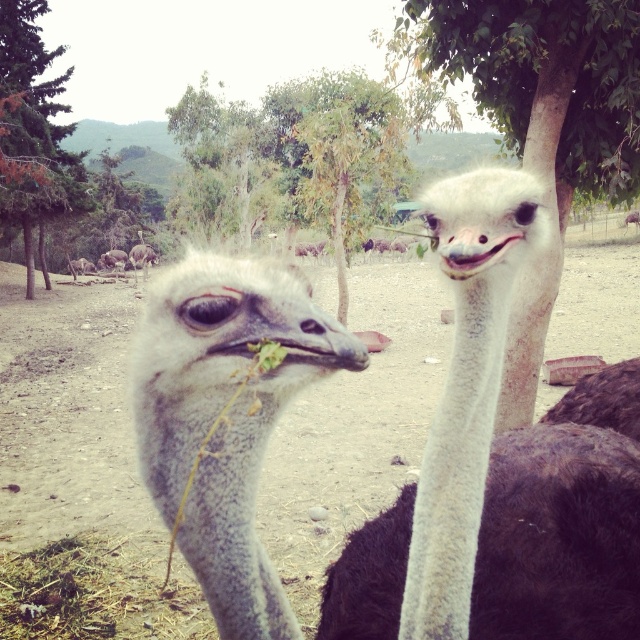
You are a wildlife photographer aiming to capture a photo of both the white feathered ostrich at center and the white fuzzy neck at center. Since you want them both in focus, you need to know which one is closer to you. Based on the scene, which one is closer?

The white fuzzy neck at center is closer to you because it is positioned to the left of the white feathered ostrich at center, which is to its right.

You are a wildlife photographer trying to capture a clear shot of both the white feathered ostrich at center and the white fuzzy neck at center. Since your camera has a limited field of view, you need to know which object is wider to frame the shot properly. Which one has a greater width?

The white feathered ostrich at center is wider than the white fuzzy neck at center according to the description, so you should frame the shot to accommodate the width of the white feathered ostrich at center.

You are a wildlife photographer trying to capture a photo of the white feathered ostrich at center and the white fuzzy neck at center. You want to ensure both subjects are in focus. Which one should you focus on first to ensure proper alignment?

The white feathered ostrich at center is located below the white fuzzy neck at center, so you should focus on the white fuzzy neck at center first since it is closer to the camera.